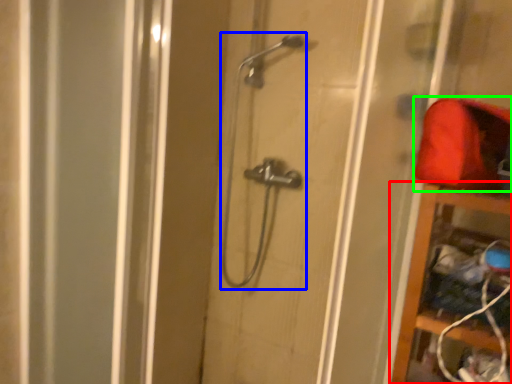
Question: Which object is the farthest from cabinet (highlighted by a red box)? Choose among these: shower (highlighted by a blue box) or material (highlighted by a green box).

Choices:
 (A) shower
 (B) material

Answer: (A)